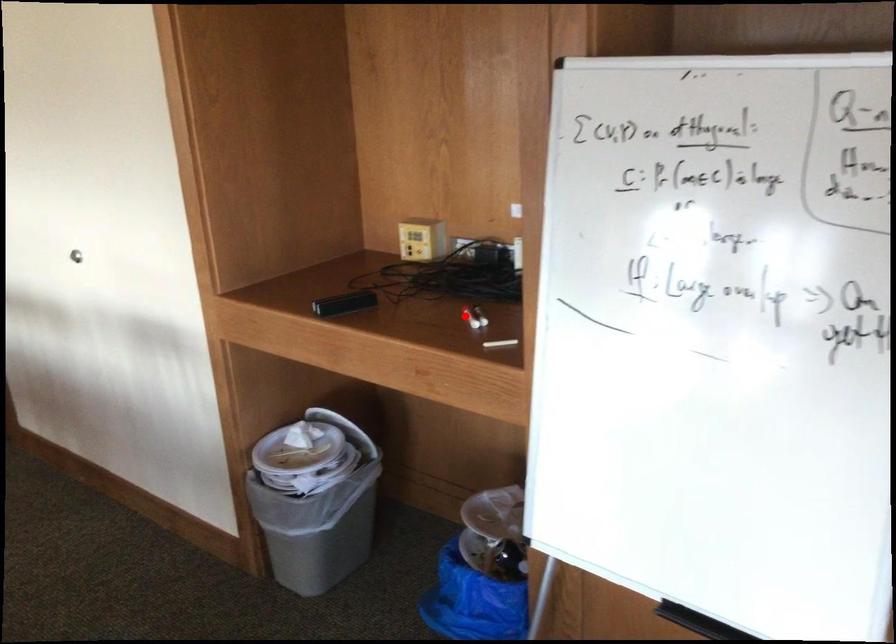
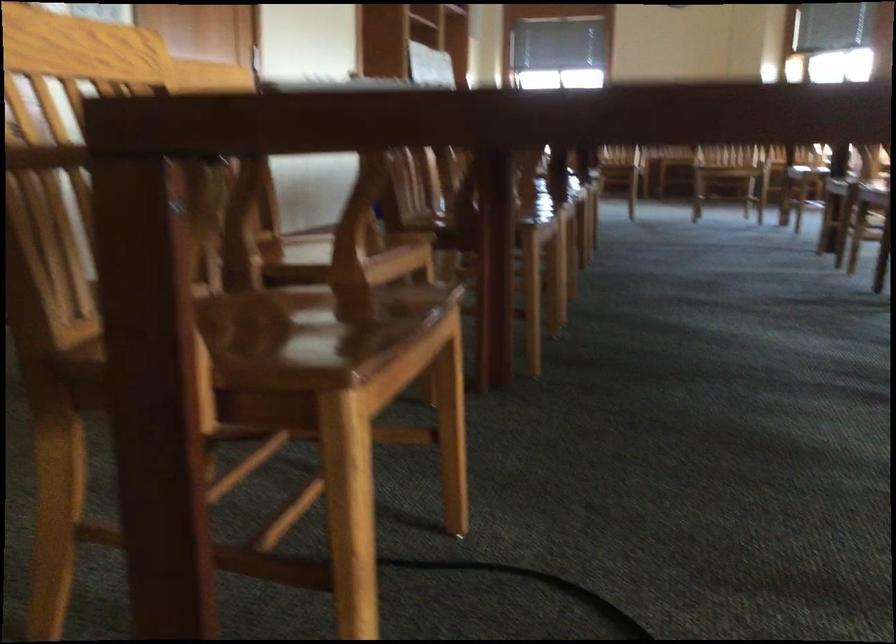
Question: I am providing you with two images of the same scene from different viewpoints. A red point is marked on the first image. At the location where the point appears in image 1, is it still visible in image 2?

Choices:
 (A) Yes
 (B) No

Answer: (B)